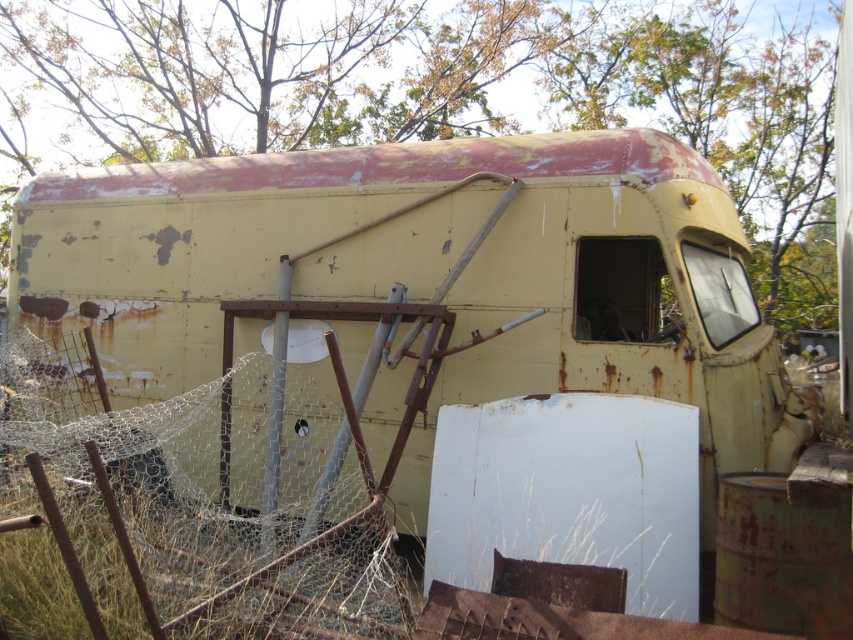
You are a painter assessing the rusty yellow trailer at center and the rusty wire mesh at center. Which object should you prioritize painting first if you want to start with the taller one?

The rusty yellow trailer at center is much taller than the rusty wire mesh at center, so you should prioritize painting the rusty yellow trailer at center first.